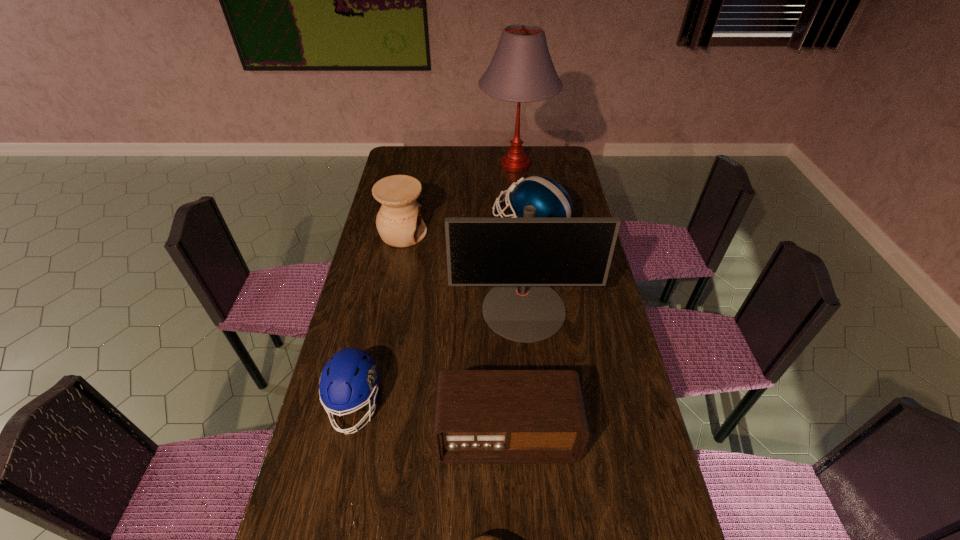
I want to click on free spot between the pottery and the farthest object, so click(x=459, y=199).

At what (x,y) coordinates should I click in order to perform the action: click on free space between the computer monitor and the nearer football helmet. Please return your answer as a coordinate pair (x, y). Image resolution: width=960 pixels, height=540 pixels. Looking at the image, I should click on (440, 357).

Identify the location of free spot between the radio receiver and the pottery. (455, 335).

Choose which object is the nearest neighbor to the radio receiver. Please provide its 2D coordinates. Your answer should be formatted as a tuple, i.e. [(x, y)], where the tuple contains the x and y coordinates of a point satisfying the conditions above.

[(350, 378)]

Identify which object is the third nearest to the pottery. Please provide its 2D coordinates. Your answer should be formatted as a tuple, i.e. [(x, y)], where the tuple contains the x and y coordinates of a point satisfying the conditions above.

[(521, 70)]

This screenshot has height=540, width=960. What are the coordinates of `vacant point that satisfies the following two spatial constraints: 1. on the front-facing side of the table lamp; 2. on the screen of the sixth shortest object` in the screenshot? It's located at (531, 309).

Locate an element on the screen. Image resolution: width=960 pixels, height=540 pixels. free space that satisfies the following two spatial constraints: 1. on the front-facing side of the farthest object; 2. on the front-facing side of the nearer football helmet is located at coordinates (541, 404).